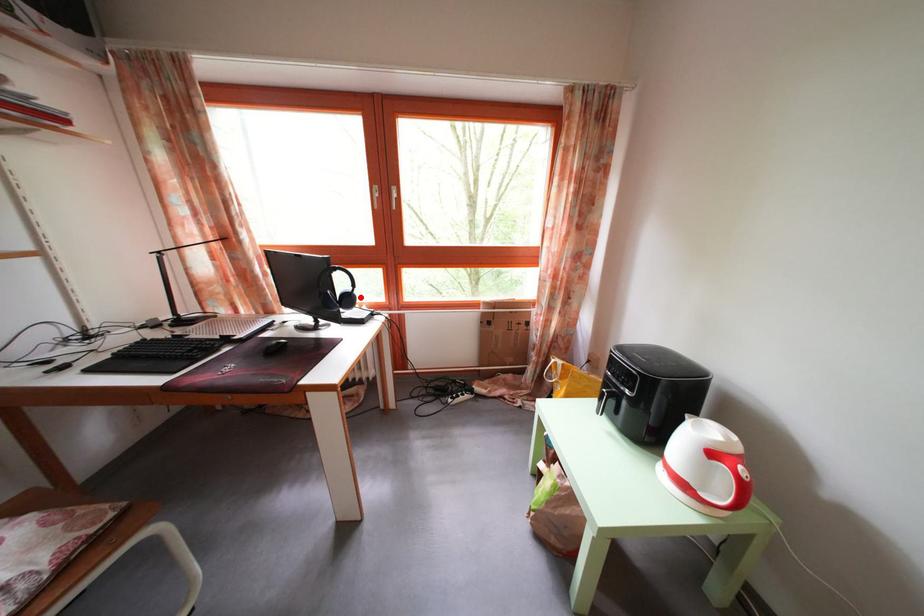
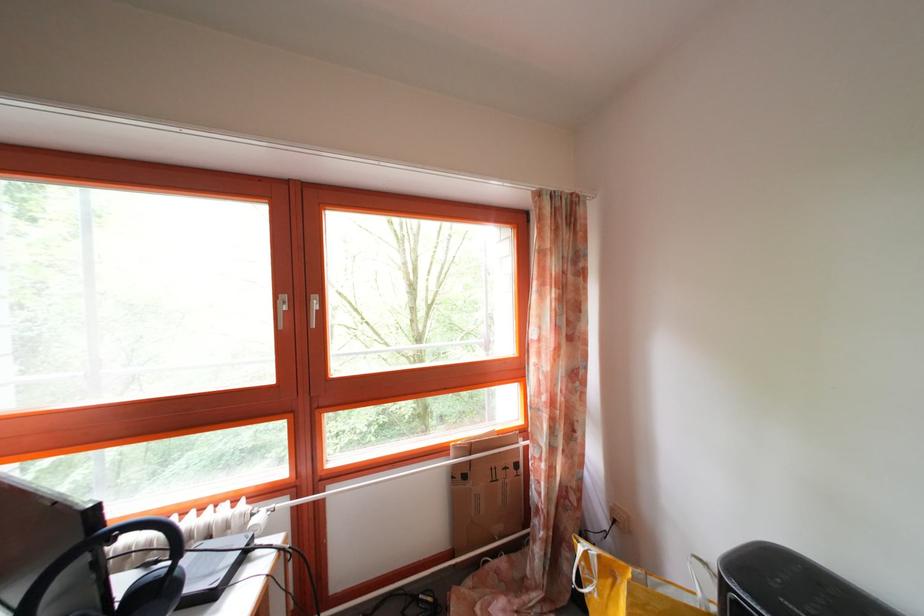
Question: I am providing you with two images of the same scene from different viewpoints. Given a red point in image1, look at the same physical point in image2. Is it:

Choices:
 (A) Closer to the viewpoint
 (B) Farther from the viewpoint

Answer: (B)